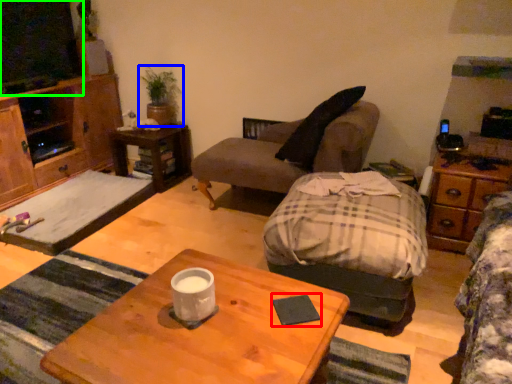
Question: Which object is the closest to the pad (highlighted by a red box)? Choose among these: houseplant (highlighted by a blue box) or television (highlighted by a green box).

Choices:
 (A) houseplant
 (B) television

Answer: (A)